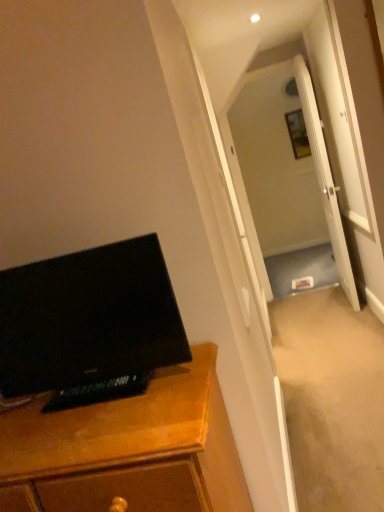
You are a GUI agent. You are given a task and a screenshot of the screen. Output one action in this format:
    pyautogui.click(x=<x>, y=<y>)
    Task: Click on the vacant region above wooden cabinet at left (from a real-world perspective)
    
    Given the screenshot: What is the action you would take?
    pyautogui.click(x=56, y=417)